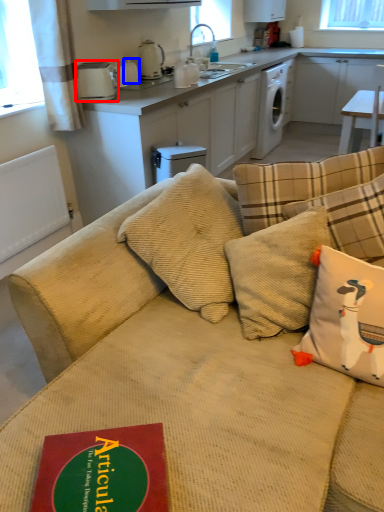
Question: Which object appears farthest to the camera in this image, appliance (highlighted by a red box) or appliance (highlighted by a blue box)?

Choices:
 (A) appliance
 (B) appliance

Answer: (B)